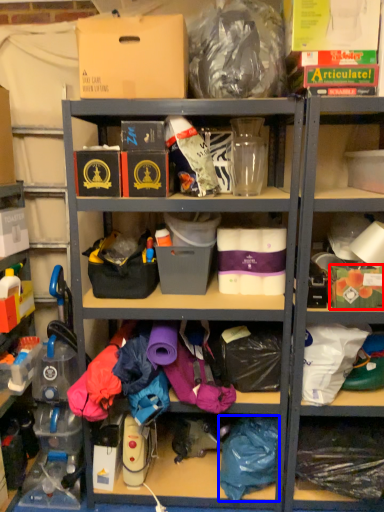
Question: Which of the following is the closest to the observer, storage box (highlighted by a red box) or clothing (highlighted by a blue box)?

Choices:
 (A) storage box
 (B) clothing

Answer: (A)